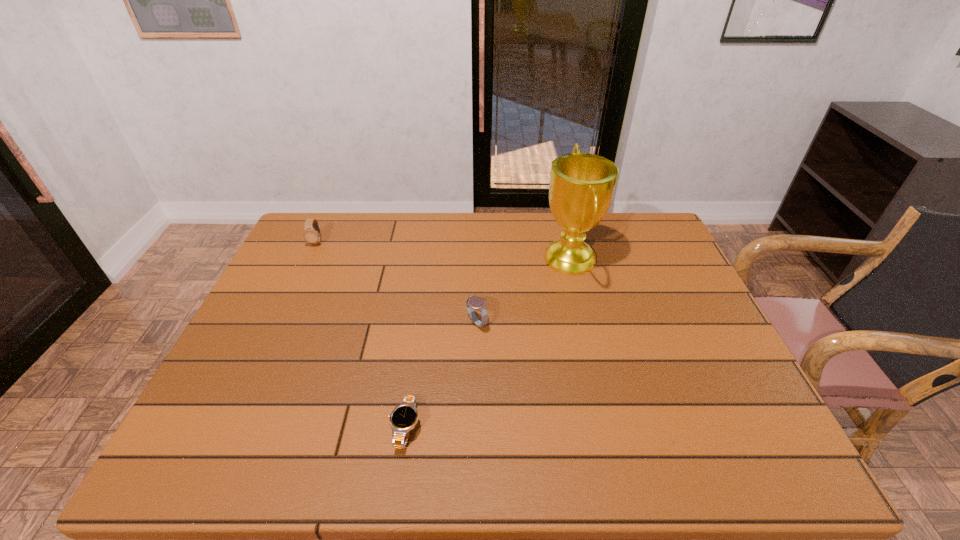
The width and height of the screenshot is (960, 540). I want to click on vacant space located 0.340m on the shiny surface of the award, so click(x=432, y=259).

You are a GUI agent. You are given a task and a screenshot of the screen. Output one action in this format:
    pyautogui.click(x=<x>, y=<y>)
    Task: Click on the free space located 0.190m on the face of the farthest watch
    The image size is (960, 540).
    Given the screenshot: What is the action you would take?
    pyautogui.click(x=296, y=287)

The image size is (960, 540). Find the location of `vacant space positioned 0.200m on the back of the rightmost watch`. vacant space positioned 0.200m on the back of the rightmost watch is located at coordinates 477,266.

I want to click on vacant position located on the back of the third object from right to left, so click(423, 299).

This screenshot has height=540, width=960. What are the coordinates of `award present at the far edge` in the screenshot? It's located at (582, 185).

You are a GUI agent. You are given a task and a screenshot of the screen. Output one action in this format:
    pyautogui.click(x=<x>, y=<y>)
    Task: Click on the watch situated at the far edge
    
    Given the screenshot: What is the action you would take?
    pyautogui.click(x=312, y=234)

In order to click on object that is at the near edge in this screenshot , I will do `click(404, 417)`.

This screenshot has width=960, height=540. Find the location of `object located in the left edge section of the desktop`. object located in the left edge section of the desktop is located at coordinates (312, 234).

At what (x,y) coordinates should I click in order to perform the action: click on object positioned at the far left corner. Please return your answer as a coordinate pair (x, y). Image resolution: width=960 pixels, height=540 pixels. Looking at the image, I should click on click(x=312, y=234).

Locate an element on the screen. vacant area at the far edge is located at coordinates (365, 215).